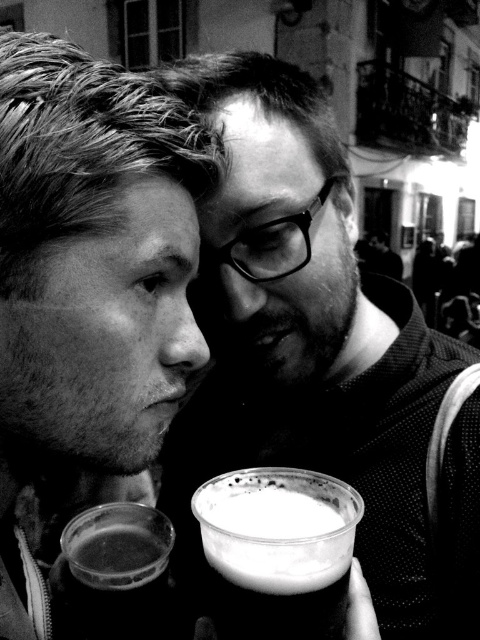
Is matte plastic cup at center below smooth skin face at left?

Actually, matte plastic cup at center is above smooth skin face at left.

Is matte plastic cup at center behind smooth skin face at left?

Yes, matte plastic cup at center is further from the viewer.

The image size is (480, 640). What are the coordinates of `matte plastic cup at center` in the screenshot? It's located at (320, 353).

Which is more to the left, foamy dark beer at lower center or translucent plastic cup at lower left?

From the viewer's perspective, translucent plastic cup at lower left appears more on the left side.

Who is more distant from viewer, (213, 493) or (96, 564)?

Positioned behind is point (96, 564).

The width and height of the screenshot is (480, 640). I want to click on foamy dark beer at lower center, so click(x=276, y=552).

Is point (171, 314) farther from camera compared to point (143, 614)?

No, it is in front of (143, 614).

Is point (146, 124) farther from viewer compared to point (126, 625)?

No, (146, 124) is in front of (126, 625).

Locate an element on the screen. The height and width of the screenshot is (640, 480). smooth skin face at left is located at coordinates (93, 257).